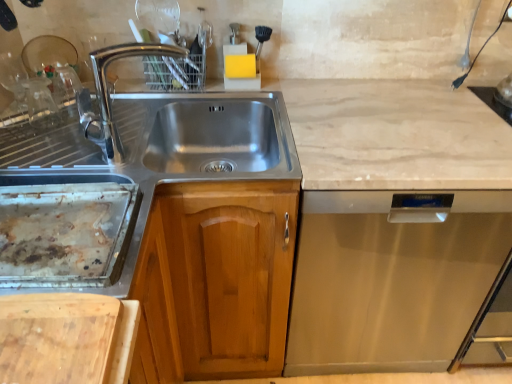
What is the approximate width of wooden cutting board at lower left?

26.43 centimeters.

Find the location of `stainless steel dishwasher at right`. stainless steel dishwasher at right is located at coordinates (390, 281).

This screenshot has width=512, height=384. What do you see at coordinates (109, 94) in the screenshot? I see `chrome metallic faucet at upper left` at bounding box center [109, 94].

Where is `chrome metallic faucet at upper left`? This screenshot has width=512, height=384. chrome metallic faucet at upper left is located at coordinates (109, 94).

Image resolution: width=512 pixels, height=384 pixels. I want to click on wooden cutting board at lower left, so click(x=67, y=338).

Considering the positions of point (166, 49) and point (183, 224), is point (166, 49) closer or farther from the camera than point (183, 224)?

Point (166, 49) is farther from the camera than point (183, 224).

This screenshot has width=512, height=384. I want to click on cabinetry on the right of the chrome metallic faucet at upper left, so click(x=215, y=280).

Is chrome metallic faucet at upper left bigger than wooden cabinet at center?

No, chrome metallic faucet at upper left is not bigger than wooden cabinet at center.

Is chrome metallic faucet at upper left wider or thinner than wooden cabinet at center?

In the image, chrome metallic faucet at upper left appears to be more narrow than wooden cabinet at center.

From the image's perspective, is chrome metallic faucet at upper left on top of wooden cutting board at lower left?

Yes.

Which is correct: chrome metallic faucet at upper left is inside wooden cutting board at lower left, or outside of it?

chrome metallic faucet at upper left exists outside the volume of wooden cutting board at lower left.

Which is closer, (121,48) or (10,345)?

Point (121,48) is positioned farther from the camera compared to point (10,345).

Does rusty metal tray at left have a lesser width compared to stainless steel dishwasher at right?

Indeed, rusty metal tray at left has a lesser width compared to stainless steel dishwasher at right.

Is stainless steel dishwasher at right at the back of rusty metal tray at left?

No.

Looking at this image, which is closer to the camera, (117, 154) or (443, 246)?

Point (117, 154)

Does chrome metallic faucet at upper left have a lesser height compared to stainless steel dishwasher at right?

Yes.

Would you say chrome metallic faucet at upper left is to the left or to the right of stainless steel dishwasher at right in the picture?

Based on their positions, chrome metallic faucet at upper left is located to the left of stainless steel dishwasher at right.

Does chrome metallic faucet at upper left come in front of stainless steel dishwasher at right?

Yes, chrome metallic faucet at upper left is in front of stainless steel dishwasher at right.

Does stainless steel dishwasher at right turn towards chrome metallic faucet at upper left?

No, stainless steel dishwasher at right is not oriented towards chrome metallic faucet at upper left.

From the image's perspective, does stainless steel dishwasher at right appear lower than chrome metallic faucet at upper left?

Yes.

Considering the relative sizes of stainless steel dishwasher at right and chrome metallic faucet at upper left in the image provided, is stainless steel dishwasher at right bigger than chrome metallic faucet at upper left?

Correct, stainless steel dishwasher at right is larger in size than chrome metallic faucet at upper left.

Considering the sizes of objects stainless steel dishwasher at right and chrome metallic faucet at upper left in the image provided, who is taller, stainless steel dishwasher at right or chrome metallic faucet at upper left?

Standing taller between the two is stainless steel dishwasher at right.

Would you say rusty metal tray at left is inside or outside wooden cabinet at center?

rusty metal tray at left is not inside wooden cabinet at center, it's outside.

Could you tell me if rusty metal tray at left is turned towards wooden cabinet at center?

No, rusty metal tray at left does not turn towards wooden cabinet at center.

From a real-world perspective, who is located higher, rusty metal tray at left or wooden cabinet at center?

From a 3D spatial view, rusty metal tray at left is above.

Locate an element on the screen. appliance located above the wooden cabinet at center (from a real-world perspective) is located at coordinates (65, 230).

What's the angular difference between chrome metallic faucet at upper left and rusty metal tray at left's facing directions?

chrome metallic faucet at upper left and rusty metal tray at left are facing 69.2 degrees away from each other.

Between chrome metallic faucet at upper left and rusty metal tray at left, which one is positioned behind?

chrome metallic faucet at upper left is further away from the camera.

From the picture: From a real-world perspective, is chrome metallic faucet at upper left physically above rusty metal tray at left?

Yes, from a real-world perspective, chrome metallic faucet at upper left is on top of rusty metal tray at left.

Is chrome metallic faucet at upper left looking in the opposite direction of rusty metal tray at left?

No, chrome metallic faucet at upper left is not facing away from rusty metal tray at left.

Find the location of a particular element. cabinetry lying behind the chrome metallic faucet at upper left is located at coordinates (215, 280).

At what (x,y) coordinates should I click in order to perform the action: click on cutting board that appears in front of the chrome metallic faucet at upper left. Please return your answer as a coordinate pair (x, y). This screenshot has width=512, height=384. Looking at the image, I should click on (67, 338).

Looking at the image, which one is located closer to chrome metallic faucet at upper left, wooden cabinet at center or stainless steel dishwasher at right?

The object closer to chrome metallic faucet at upper left is wooden cabinet at center.

Which object lies further to the anchor point wooden cabinet at center, wooden cutting board at lower left or stainless steel dishwasher at right?

wooden cutting board at lower left.

From the image, which object appears to be farther from rusty metal tray at left, wooden cutting board at lower left or chrome metallic faucet at upper left?

The object further to rusty metal tray at left is chrome metallic faucet at upper left.

Estimate the real-world distances between objects in this image. Which object is further from stainless steel dishwasher at right, wooden cabinet at center or wooden cutting board at lower left?

Among the two, wooden cutting board at lower left is located further to stainless steel dishwasher at right.

Based on their spatial positions, is chrome metallic faucet at upper left or stainless steel dishwasher at right closer to wooden cutting board at lower left?

chrome metallic faucet at upper left is closer to wooden cutting board at lower left.

Looking at the image, which one is located closer to stainless steel dishwasher at right, wooden cabinet at center or rusty metal tray at left?

Based on the image, wooden cabinet at center appears to be nearer to stainless steel dishwasher at right.

Estimate the real-world distances between objects in this image. Which object is further from wooden cutting board at lower left, stainless steel dishwasher at right or wooden cabinet at center?

Among the two, stainless steel dishwasher at right is located further to wooden cutting board at lower left.

From the image, which object appears to be farther from chrome metallic faucet at upper left, wooden cabinet at center or wooden cutting board at lower left?

Based on the image, wooden cutting board at lower left appears to be further to chrome metallic faucet at upper left.

Where is `appliance between wooden cutting board at lower left and wooden cabinet at center along the z-axis`? The height and width of the screenshot is (384, 512). appliance between wooden cutting board at lower left and wooden cabinet at center along the z-axis is located at coordinates (65, 230).

Locate an element on the screen. The image size is (512, 384). cabinetry between wooden cutting board at lower left and stainless steel dishwasher at right from left to right is located at coordinates (215, 280).

Find the location of `cutting board between rusty metal tray at left and stainless steel dishwasher at right`. cutting board between rusty metal tray at left and stainless steel dishwasher at right is located at coordinates (67, 338).

At what (x,y) coordinates should I click in order to perform the action: click on cabinetry between chrome metallic faucet at upper left and stainless steel dishwasher at right. Please return your answer as a coordinate pair (x, y). Looking at the image, I should click on (215, 280).